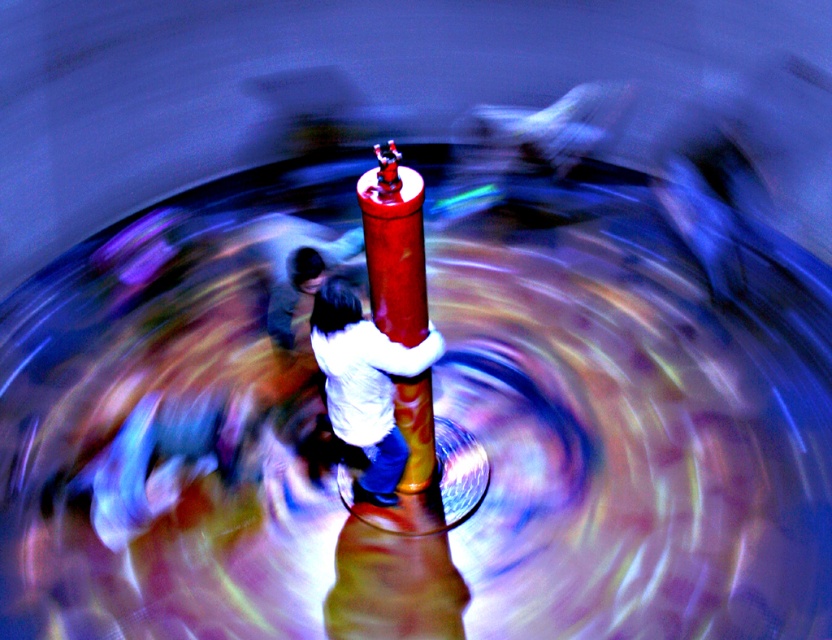
Question: Can you confirm if white matte shirt at center is positioned below shiny red pole at center?

Choices:
 (A) no
 (B) yes

Answer: (B)

Question: Does white matte shirt at center have a lesser width compared to shiny red pole at center?

Choices:
 (A) no
 (B) yes

Answer: (A)

Question: Observing the image, what is the correct spatial positioning of white matte shirt at center in reference to shiny red pole at center?

Choices:
 (A) left
 (B) right

Answer: (A)